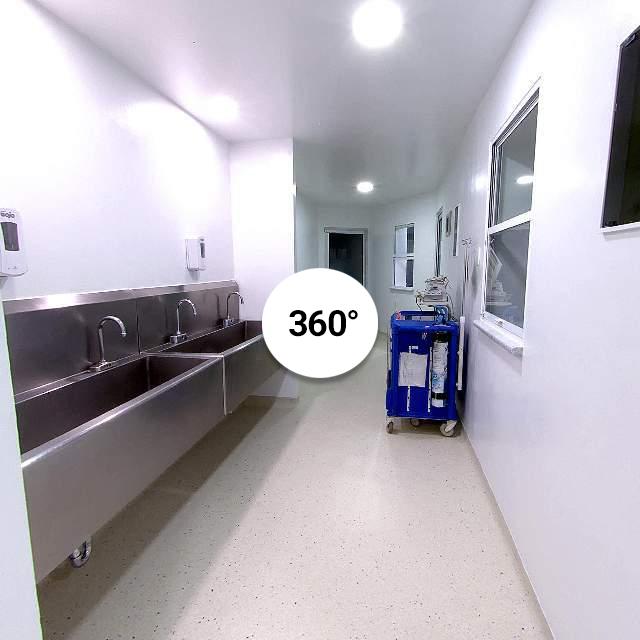
Identify the location of sink basin. The width and height of the screenshot is (640, 640). (220, 348), (118, 388).